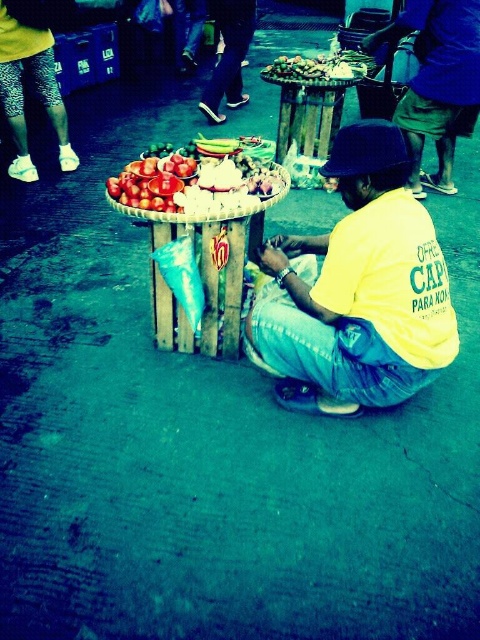
Based on the photo, you are standing at the point labeled point (436, 83) in the image. What color is the shirt of the person closest to you?

The point (436, 83) is on matte blue shirt at center, so the closest person has a blue shirt.

You are a customer looking at the wooden basket at center and the shiny red tomatoes at center. Which object is nearer to you?

The wooden basket at center is closer to the viewer than the shiny red tomatoes at center.

You are a customer at the vendor cart. You want to place a shiny red tomatoes at center into the wooden basket at center. Will the tomatoes fit inside the basket?

The wooden basket at center has a larger size compared to shiny red tomatoes at center, so the tomatoes will fit inside the basket.